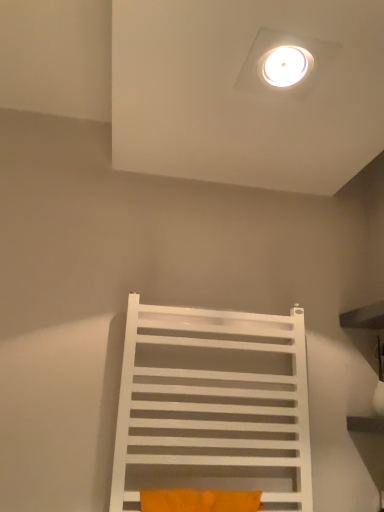
Question: From a real-world perspective, is orange fabric pillow at lower center above or below white matte towel rack at center?

Choices:
 (A) below
 (B) above

Answer: (A)

Question: Relative to white matte towel rack at center, is orange fabric pillow at lower center in front or behind?

Choices:
 (A) behind
 (B) front

Answer: (B)

Question: Is orange fabric pillow at lower center situated inside white matte towel rack at center or outside?

Choices:
 (A) outside
 (B) inside

Answer: (B)

Question: Is point (127, 430) closer or farther from the camera than point (236, 501)?

Choices:
 (A) farther
 (B) closer

Answer: (B)

Question: From their relative heights in the image, would you say white matte towel rack at center is taller or shorter than orange fabric pillow at lower center?

Choices:
 (A) short
 (B) tall

Answer: (B)

Question: Is white matte towel rack at center in front of or behind orange fabric pillow at lower center in the image?

Choices:
 (A) behind
 (B) front

Answer: (A)

Question: From a real-world perspective, relative to orange fabric pillow at lower center, is white matte towel rack at center vertically above or below?

Choices:
 (A) below
 (B) above

Answer: (B)